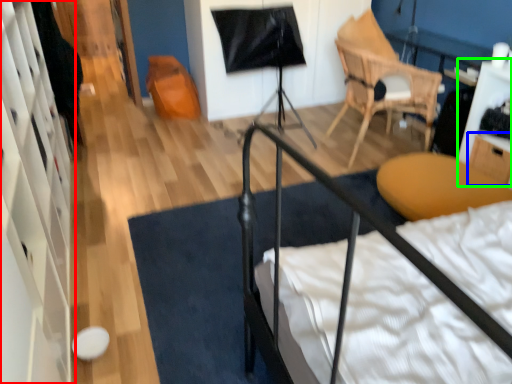
Question: Which is nearer to the dresser (highlighted by a red box)? drawer (highlighted by a blue box) or table (highlighted by a green box).

Choices:
 (A) drawer
 (B) table

Answer: (A)